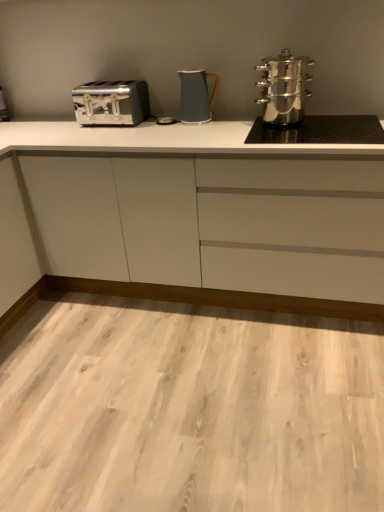
Question: In terms of size, does white matte cabinet at center appear bigger or smaller than polished stainless steel steamer at right, the second kitchen appliance when ordered from left to right?

Choices:
 (A) big
 (B) small

Answer: (A)

Question: In terms of width, does white matte cabinet at center look wider or thinner when compared to polished stainless steel steamer at right, the second kitchen appliance when ordered from left to right?

Choices:
 (A) wide
 (B) thin

Answer: (A)

Question: Which object is positioned closest to the satin chrome toaster at left?

Choices:
 (A) matte blue pitcher at center, arranged as the second kitchen appliance when viewed from the right
 (B) satin silver toaster at left
 (C) white matte cabinet at center
 (D) polished stainless steel steamer at right, which is counted as the 1th kitchen appliance, starting from the right

Answer: (C)

Question: Which object is positioned closest to the satin chrome toaster at left?

Choices:
 (A) matte blue pitcher at center, marked as the first kitchen appliance in a left-to-right arrangement
 (B) white matte cabinet at center
 (C) polished stainless steel steamer at right, which is counted as the 1th kitchen appliance, starting from the right
 (D) satin silver toaster at left

Answer: (B)